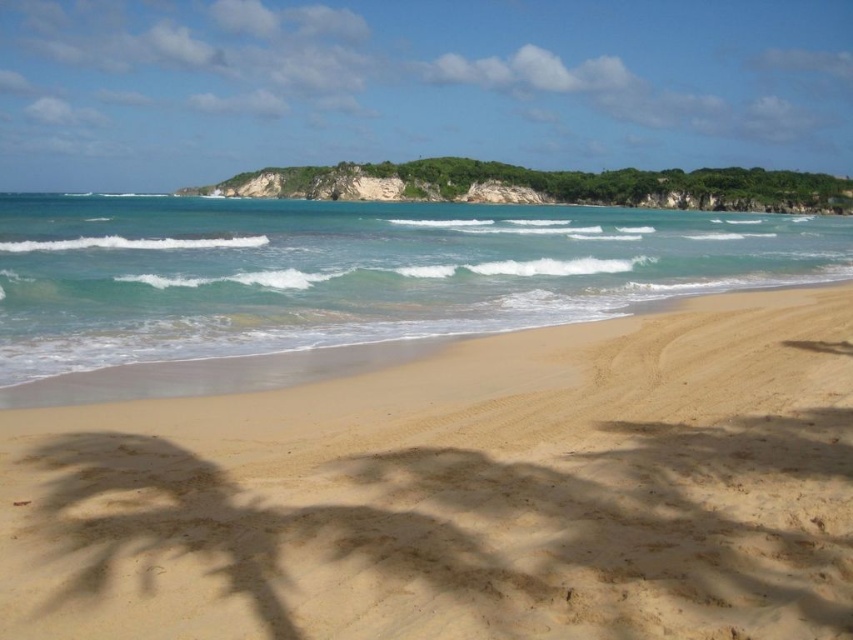
You are standing on the beach and see the golden sand at center and the green leafy island at center. Which object is positioned to the right of the other?

The golden sand at center is to the right of the green leafy island at center.

You are standing on the beach looking out at the ocean. You see the golden sand at center and the green leafy island at center. Which object is closer to the horizon?

The green leafy island at center is closer to the horizon because it is above the golden sand at center, which is located below it.

You are standing on the beach and looking out towards the ocean. Which object, the golden sand at center or the green leafy island at center, is closer to you?

The golden sand at center is closer to you because it is in front of the green leafy island at center.